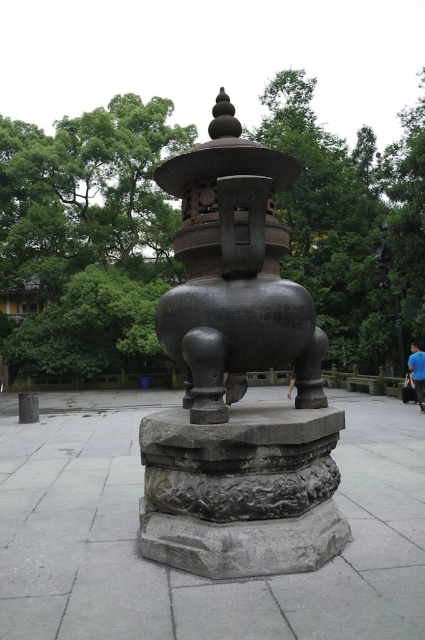
Question: Can you confirm if bronze textured censer at center is positioned to the left of blue fabric person at lower right?

Choices:
 (A) yes
 (B) no

Answer: (A)

Question: Can you confirm if bronze textured censer at center is thinner than blue fabric person at lower right?

Choices:
 (A) no
 (B) yes

Answer: (A)

Question: Which object appears farthest from the camera in this image?

Choices:
 (A) blue fabric person at lower right
 (B) bronze textured censer at center

Answer: (A)

Question: Is bronze textured censer at center closer to the viewer compared to blue fabric person at lower right?

Choices:
 (A) yes
 (B) no

Answer: (A)

Question: Among these objects, which one is farthest from the camera?

Choices:
 (A) blue fabric person at lower right
 (B) bronze textured censer at center

Answer: (A)